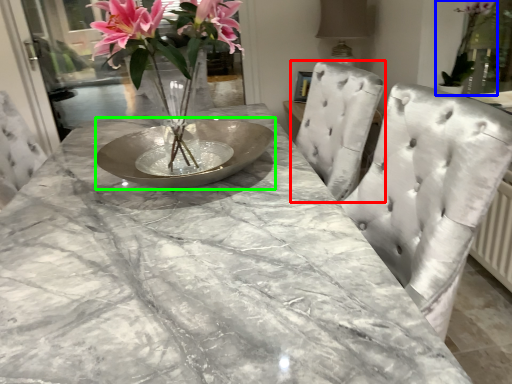
Question: Based on their relative distances, which object is farther from chair (highlighted by a red box)? Choose from houseplant (highlighted by a blue box) and glass plate (highlighted by a green box).

Choices:
 (A) houseplant
 (B) glass plate

Answer: (A)